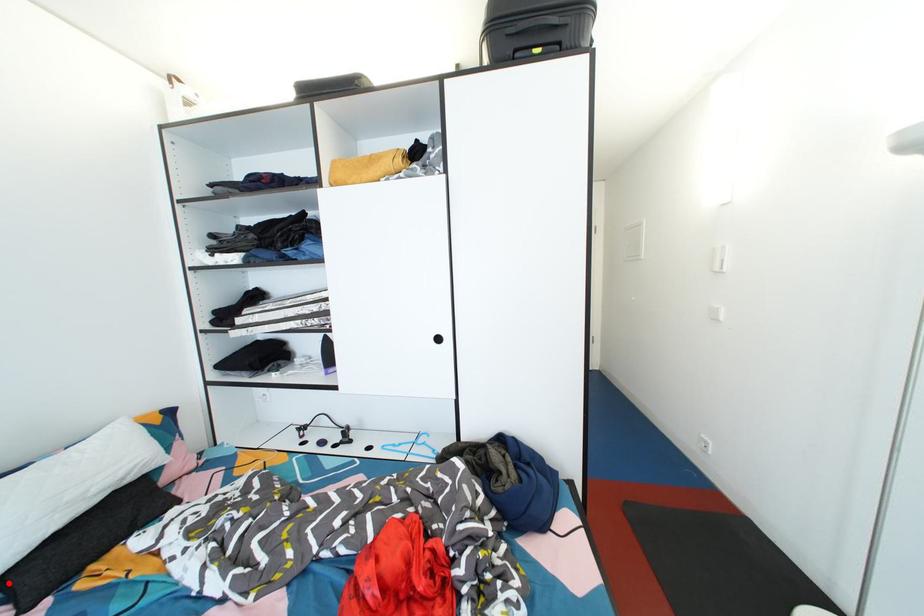
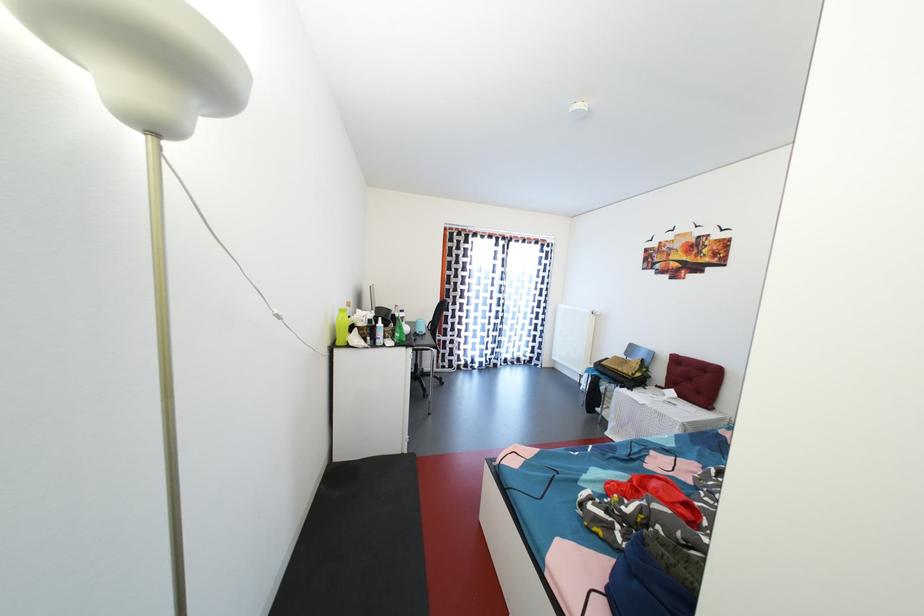
Question: I am providing you with two images of the same scene from different viewpoints. A red point is marked on the first image. Is the red point's position out of view in image 2?

Choices:
 (A) Yes
 (B) No

Answer: (A)